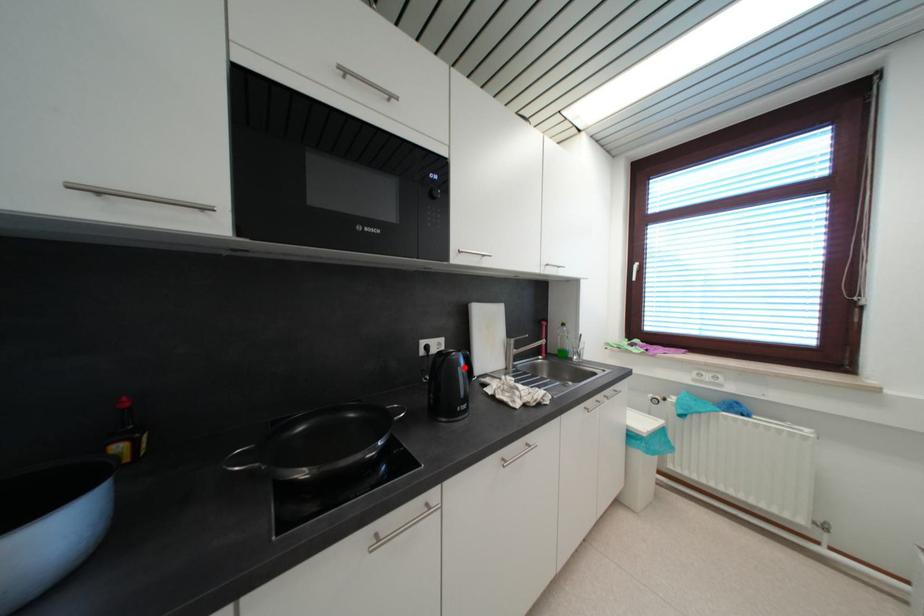
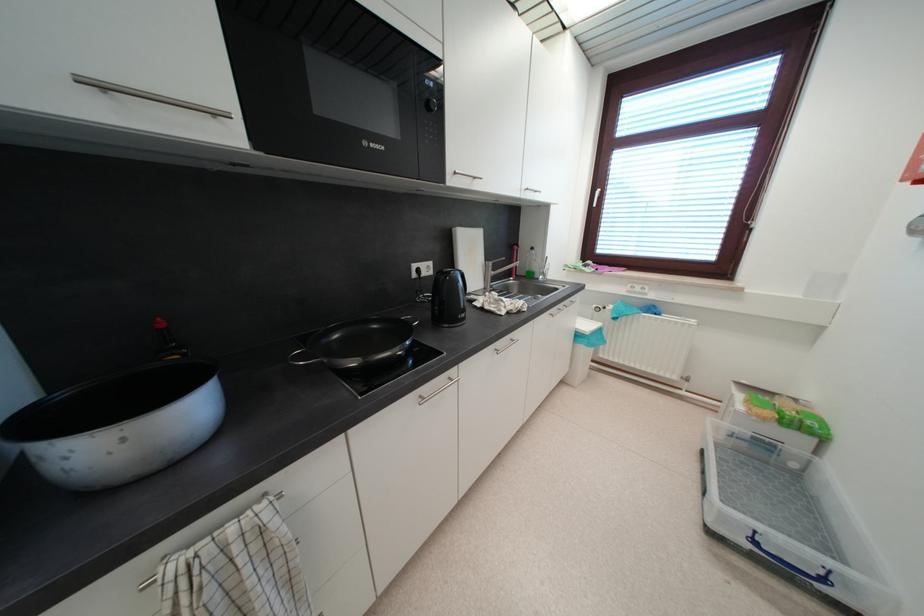
Question: A red point is marked in image1. In image2, is the corresponding 3D point closer to the camera or farther? Reply with the corresponding letter.

Choices:
 (A) The corresponding 3D point is closer.
 (B) The corresponding 3D point is farther.

Answer: (A)